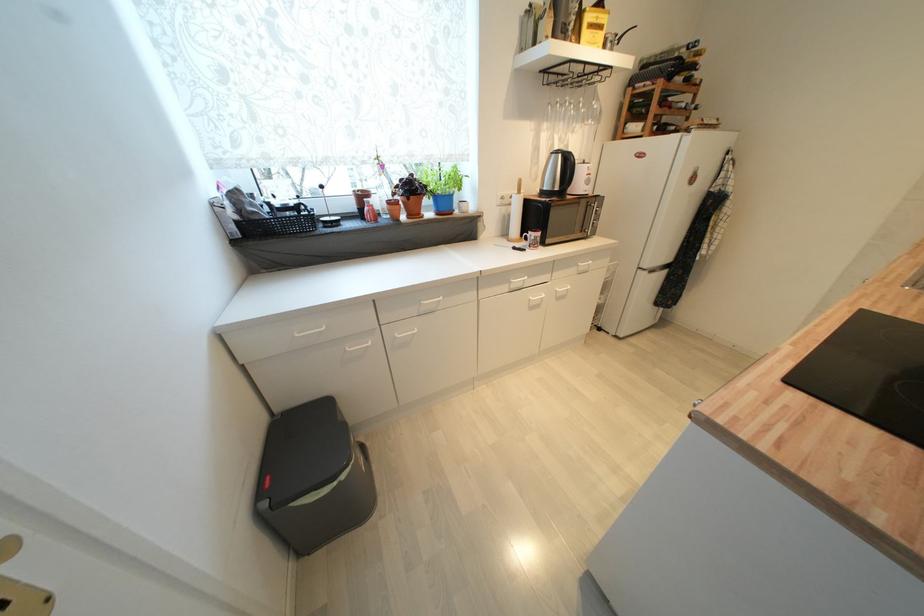
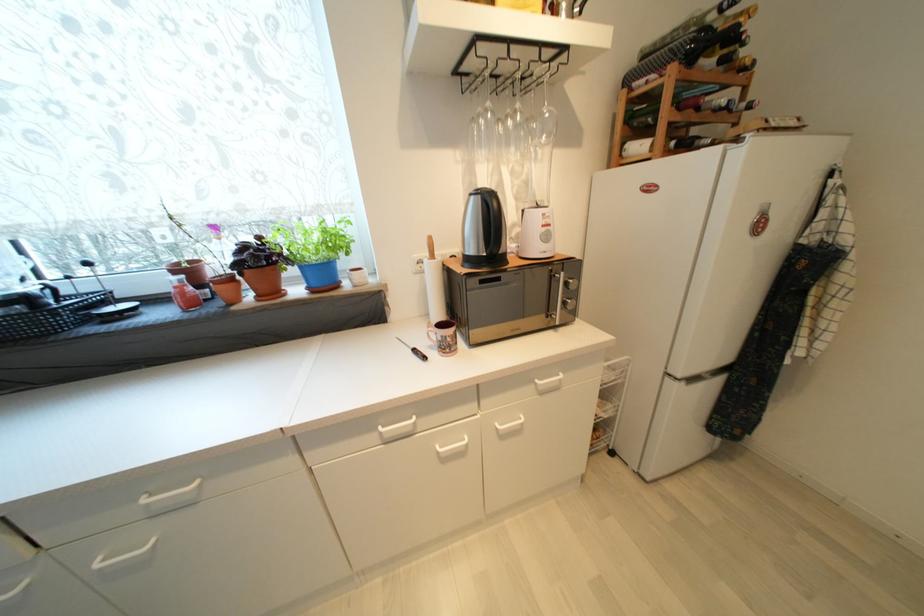
Question: The images are taken continuously from a first-person perspective. In which direction is your viewpoint rotating?

Choices:
 (A) Left
 (B) Right
 (C) Up
 (D) Down

Answer: (A)